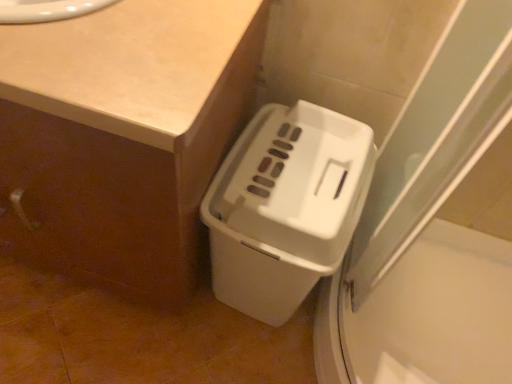
Question: Is point (302, 125) positioned closer to the camera than point (169, 52)?

Choices:
 (A) closer
 (B) farther

Answer: (B)

Question: Considering the relative positions of white plastic waste container at lower right and white matte counter at lower right in the image provided, is white plastic waste container at lower right to the left or to the right of white matte counter at lower right?

Choices:
 (A) left
 (B) right

Answer: (B)

Question: Which object is the farthest from the white plastic waste container at lower right?

Choices:
 (A) beige laminate counter at upper left
 (B) white matte counter at lower right

Answer: (A)

Question: Estimate the real-world distances between objects in this image. Which object is closer to the beige laminate counter at upper left?

Choices:
 (A) white plastic waste container at lower right
 (B) white matte counter at lower right

Answer: (B)